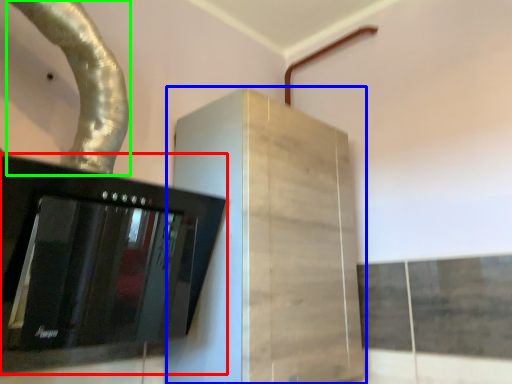
Question: Which object is positioned farthest from home appliance (highlighted by a red box)? Select from cabinetry (highlighted by a blue box) and water pipe (highlighted by a green box).

Choices:
 (A) cabinetry
 (B) water pipe

Answer: (B)